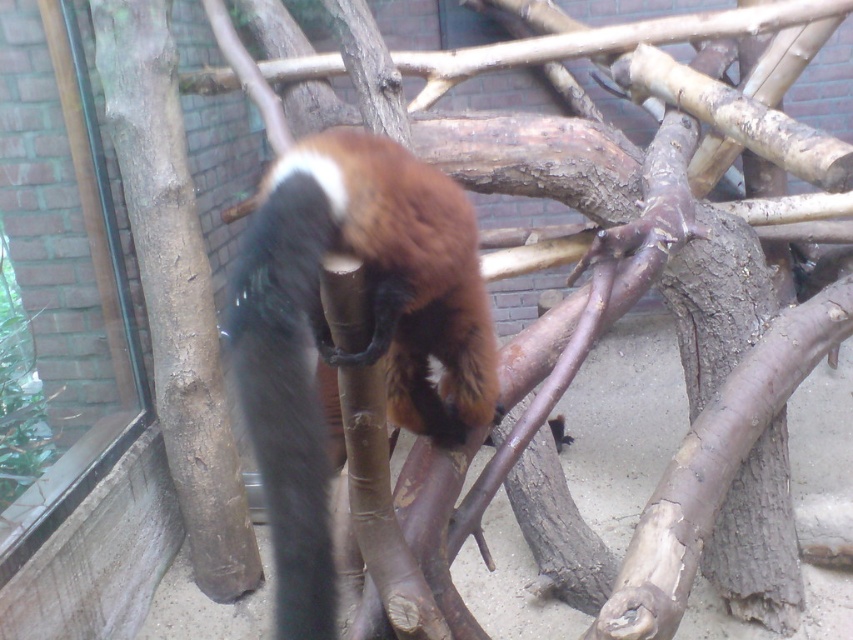
Looking at this image, you are a zookeeper trying to determine if a new feeding platform can fit between the brown furry animal at center and the brown rough tree trunk at left. The platform requires 1 meter of space. Can you fit it there?

The brown furry animal at center has a lesser width compared to brown rough tree trunk at left. Since the animal is narrower than the tree trunk, there might be enough space between them for the platform. However, the exact distance isn